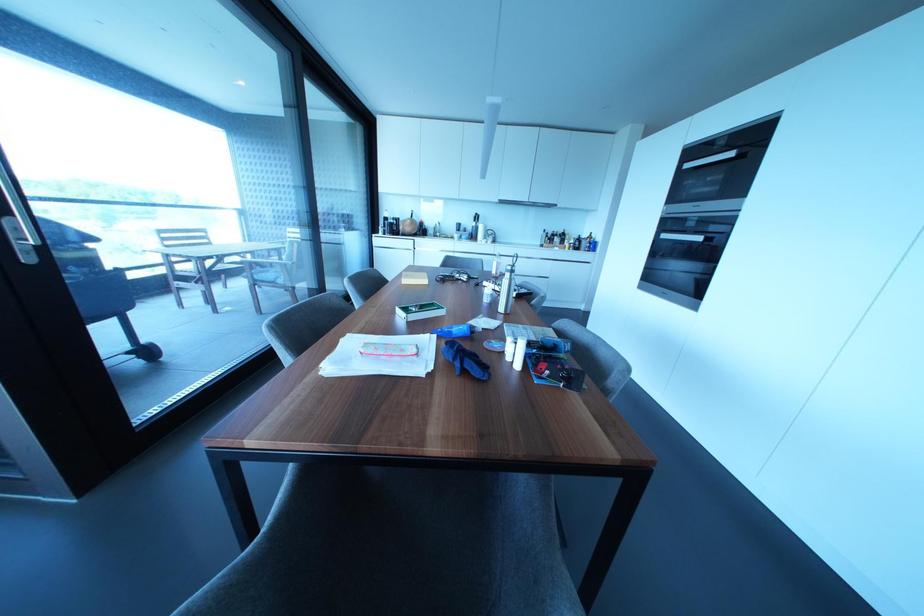
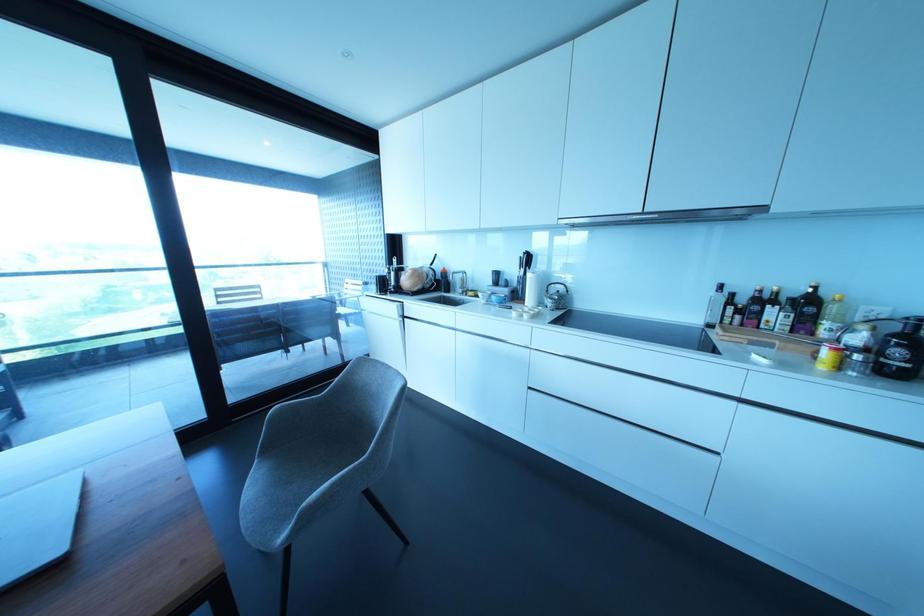
Question: I am providing you with two images of the same scene from different viewpoints. Please identify which objects are invisible in image2.

Choices:
 (A) small white bowl
 (B) yellow can
 (C) chair armrest
 (D) none of these

Answer: (D)